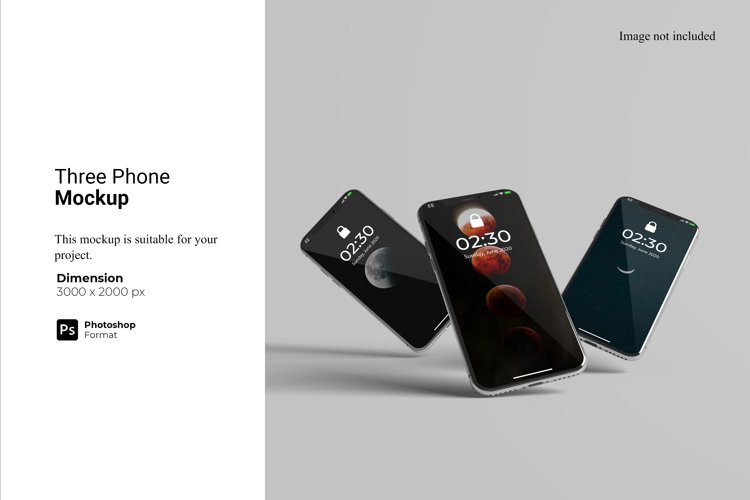
Identify the location of phone. (403, 311).